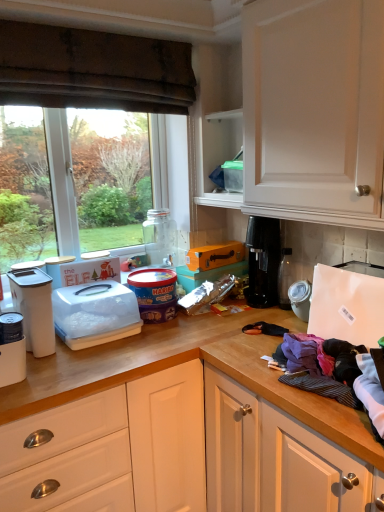
I want to click on empty space that is ontop of brown fabric curtain at upper left (from a real-world perspective), so click(x=110, y=30).